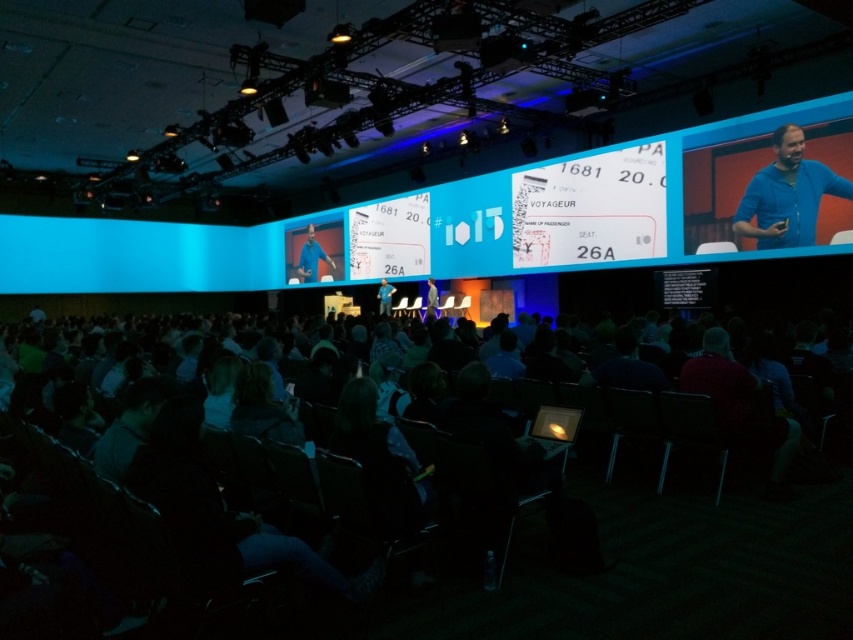
This screenshot has height=640, width=853. Describe the element at coordinates (787, 195) in the screenshot. I see `blue cotton shirt at upper right` at that location.

Which is behind, point (735, 220) or point (432, 288)?

Point (432, 288)

Is point (786, 138) less distant than point (428, 316)?

Yes, it is.

Locate an element on the screen. The height and width of the screenshot is (640, 853). blue cotton shirt at upper right is located at coordinates (787, 195).

Can you confirm if blue shirt at center is bigger than light blue fabric suit at center?

Correct, blue shirt at center is larger in size than light blue fabric suit at center.

Where is `blue shirt at center`? Image resolution: width=853 pixels, height=640 pixels. blue shirt at center is located at coordinates (384, 298).

Between blue fabric shirt at center and blue shirt at center, which one is positioned lower?

Positioned lower is blue shirt at center.

Which of these two, blue fabric shirt at center or blue shirt at center, stands shorter?

blue shirt at center

The height and width of the screenshot is (640, 853). In order to click on blue fabric shirt at center in this screenshot , I will do `click(311, 257)`.